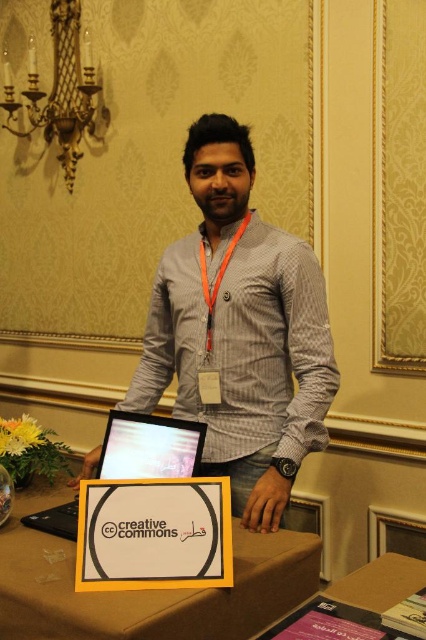
Based on the photo, who is shorter, gray woven shirt at center or skinny orange lanyard at center?

skinny orange lanyard at center is shorter.

How far apart are gray woven shirt at center and skinny orange lanyard at center?

The distance of gray woven shirt at center from skinny orange lanyard at center is 12.96 inches.

Image resolution: width=426 pixels, height=640 pixels. What do you see at coordinates (242, 356) in the screenshot?
I see `gray woven shirt at center` at bounding box center [242, 356].

Image resolution: width=426 pixels, height=640 pixels. In order to click on gray woven shirt at center in this screenshot , I will do `click(242, 356)`.

In the scene shown: Can you confirm if yellow fabric table at center is positioned to the right of satin black laptop at center?

Indeed, yellow fabric table at center is positioned on the right side of satin black laptop at center.

Can you confirm if yellow fabric table at center is positioned below satin black laptop at center?

Yes, yellow fabric table at center is below satin black laptop at center.

Who is more forward, [5,573] or [187,474]?

Point [5,573] is in front.

This screenshot has height=640, width=426. What are the coordinates of `yellow fabric table at center` in the screenshot? It's located at (146, 589).

Who is more forward, (178, 632) or (210, 301)?

Point (178, 632) is in front.

Does yellow fabric table at center appear over orange fabric lanyard at center?

No.

Between point (247, 570) and point (215, 284), which one is positioned behind?

The point (215, 284) is more distant.

Locate an element on the screen. The image size is (426, 640). yellow fabric table at center is located at coordinates tap(146, 589).